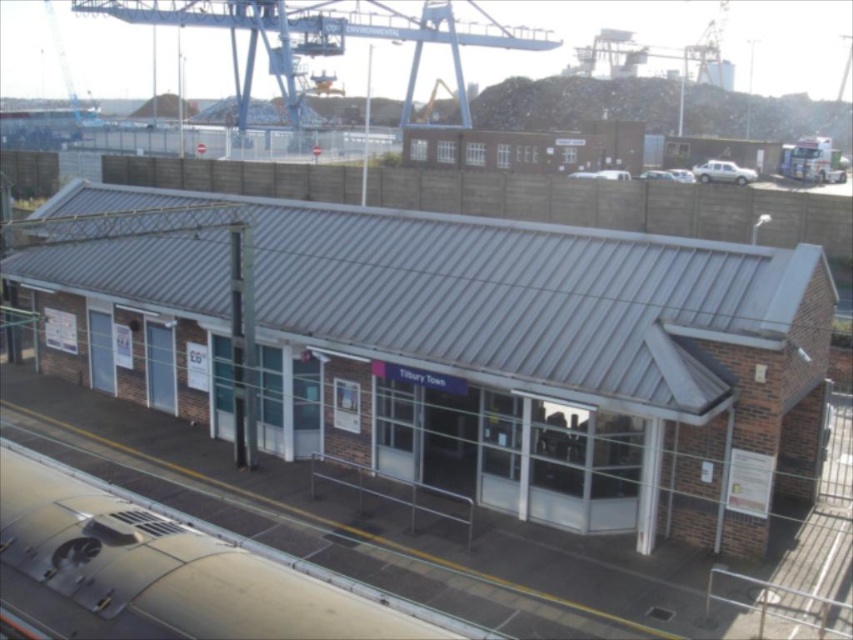
Which is behind, point (808, 312) or point (524, 49)?

Positioned behind is point (524, 49).

Locate an element on the screen. This screenshot has width=853, height=640. metallic brick shed at center is located at coordinates (535, 360).

I want to click on metallic silver train at lower center, so click(183, 564).

Is metallic brick shed at center wider than metallic silver train at lower center?

Yes.

Is metallic brick shed at center above metallic silver train at lower center?

Yes.

Does point (474, 332) lie behind point (128, 545)?

Yes.

The height and width of the screenshot is (640, 853). Identify the location of metallic brick shed at center. (535, 360).